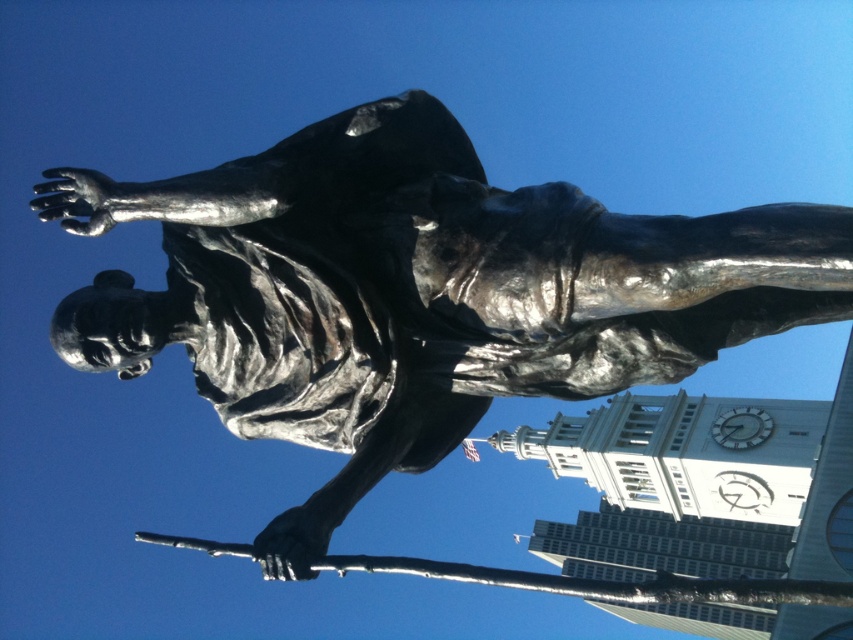
Does white stone clock tower at center lie in front of white glossy clock at upper right?

Yes, white stone clock tower at center is in front of white glossy clock at upper right.

What do you see at coordinates (675, 486) in the screenshot?
I see `white stone clock tower at center` at bounding box center [675, 486].

Where is `white stone clock tower at center`? The width and height of the screenshot is (853, 640). white stone clock tower at center is located at coordinates coord(675,486).